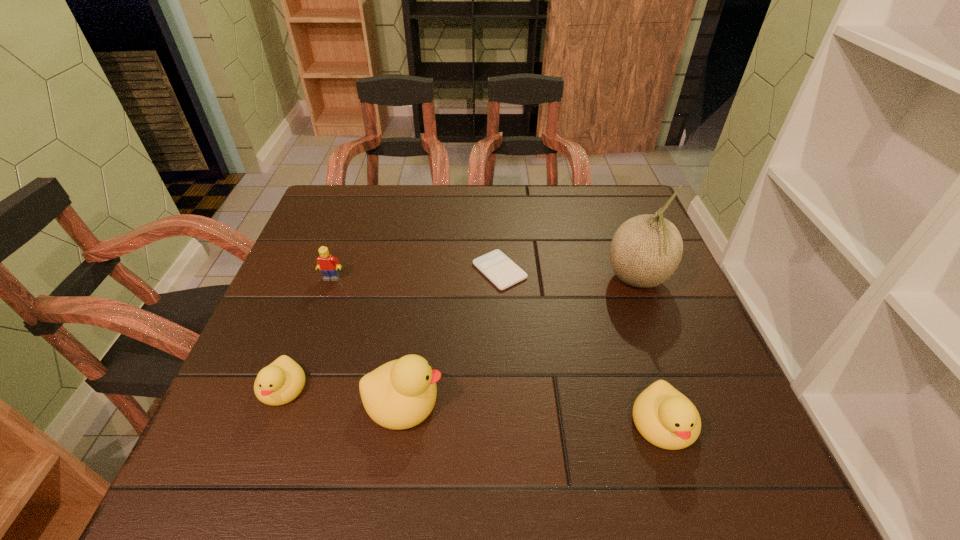
At what (x,y) coordinates should I click in order to perform the action: click on free spot that satisfies the following two spatial constraints: 1. on the front-facing side of the Lego; 2. on the right side of the cantaloup. Please return your answer as a coordinate pair (x, y). Image resolution: width=960 pixels, height=540 pixels. Looking at the image, I should click on (331, 280).